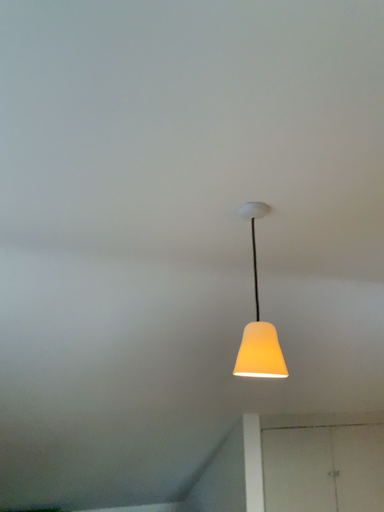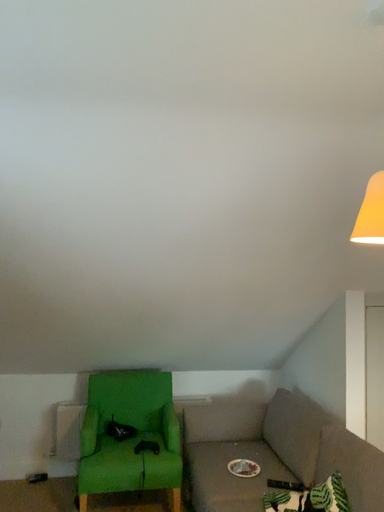
Question: Which way did the camera rotate in the video?

Choices:
 (A) rotated downward
 (B) rotated upward

Answer: (A)